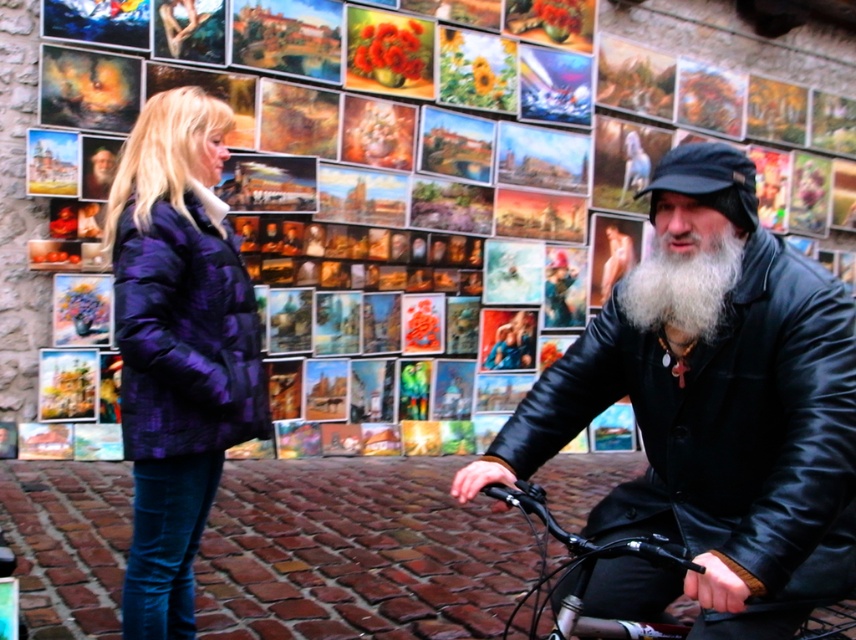
You are a fashion designer observing two jackets in an outdoor setting. The black leather jacket at right and the purple quilted jacket at left are both in the scene. Which jacket has a larger size?

The black leather jacket at right is bigger than the purple quilted jacket at left.

You are a photographer trying to capture a clear photo of both the shiny black bicycle at center and the white fluffy beard at center. Since the bicycle is closer to you, will it appear larger in the photo compared to the beard?

Yes, the shiny black bicycle at center appears larger in the photo because it is closer to the viewer than the white fluffy beard at center.